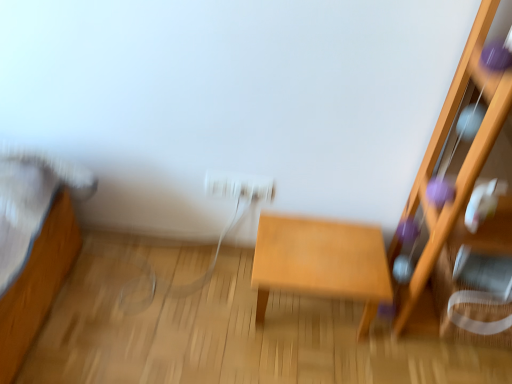
Where is `vacant space to the left of light brown wooden table at center`? This screenshot has height=384, width=512. vacant space to the left of light brown wooden table at center is located at coordinates (212, 304).